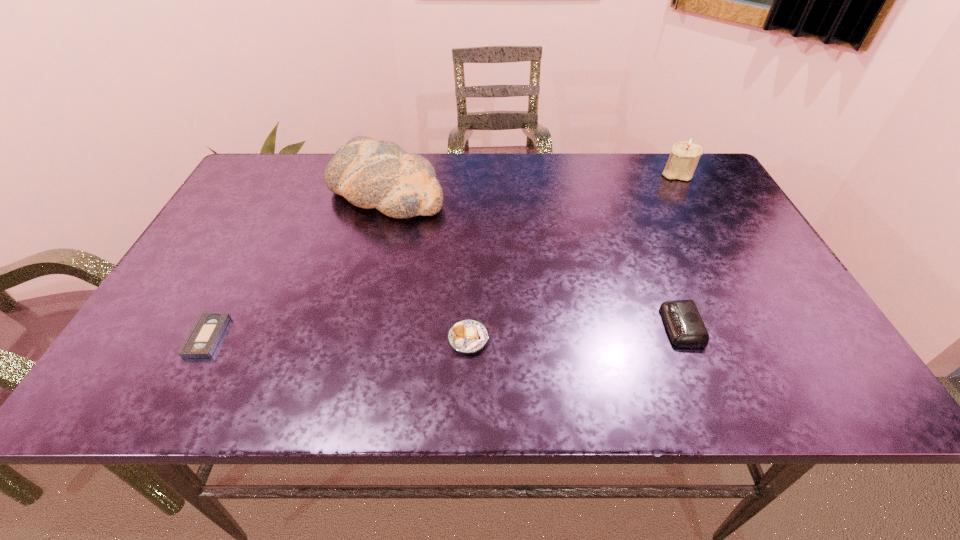
In the image, there is a desktop. Identify the location of blank space at the left edge. (213, 268).

Find the location of a particular element. free location at the right edge is located at coordinates (761, 356).

In the image, there is a desktop. What are the coordinates of `free region at the far left corner` in the screenshot? It's located at (272, 172).

This screenshot has width=960, height=540. I want to click on free location at the near left corner, so click(108, 396).

In the image, there is a desktop. Where is `vacant region at the far right corner`? This screenshot has width=960, height=540. vacant region at the far right corner is located at coordinates (680, 197).

Locate an element on the screen. The height and width of the screenshot is (540, 960). vacant point at the near right corner is located at coordinates (801, 396).

In order to click on vacant space that is in between the alarm clock and the pastry in this screenshot , I will do `click(575, 333)`.

Locate an element on the screen. free space between the alarm clock and the leftmost object is located at coordinates (444, 332).

Locate an element on the screen. This screenshot has height=540, width=960. vacant space that's between the candle_holder and the third object from right to left is located at coordinates (572, 256).

Find the location of `unoccupied position between the alarm clock and the third object from left to right`. unoccupied position between the alarm clock and the third object from left to right is located at coordinates (575, 333).